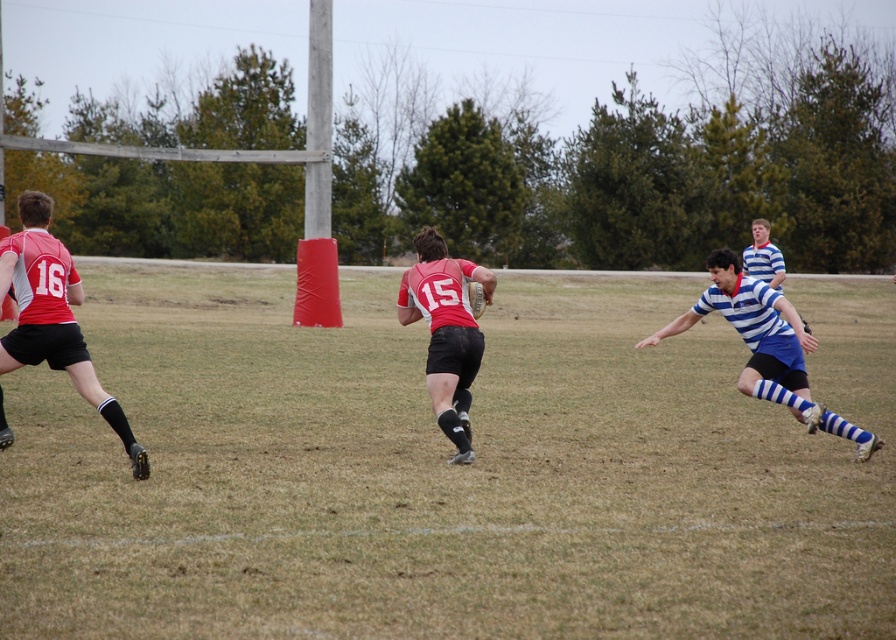
You are a referee observing the rugby match. You notice the green grass at center and the matte red jersey at center. Which object is closer to the front of the image?

The green grass at center is in front of the matte red jersey at center, so the green grass at center is closer to the front of the image.

You are a referee watching the rugby match. You see the blue striped jersey at right and the matte red jersey at center. Which player is positioned to the right of the other?

The blue striped jersey at right is positioned on the right side of matte red jersey at center.

You are a referee at a rugby match. You need to determine if the player in the blue striped jersey at right is within the required 5 feet distance to legally tackle the player in the matte red jersey at center. Based on the scene, what is your ruling?

The distance between the blue striped jersey at right and the matte red jersey at center is 7.07 feet, which exceeds the 5 feet requirement. Therefore, the tackle would be considered out of bounds and illegal.